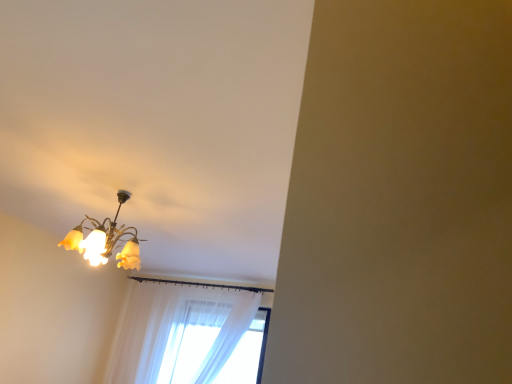
Question: Does matte glass chandelier at upper left have a lesser width compared to sheer white curtain at lower center?

Choices:
 (A) yes
 (B) no

Answer: (B)

Question: Is matte glass chandelier at upper left shorter than sheer white curtain at lower center?

Choices:
 (A) yes
 (B) no

Answer: (A)

Question: Is matte glass chandelier at upper left positioned in front of sheer white curtain at lower center?

Choices:
 (A) yes
 (B) no

Answer: (A)

Question: Can we say matte glass chandelier at upper left lies outside sheer white curtain at lower center?

Choices:
 (A) no
 (B) yes

Answer: (B)

Question: Does matte glass chandelier at upper left have a greater height compared to sheer white curtain at lower center?

Choices:
 (A) no
 (B) yes

Answer: (A)

Question: Is matte glass chandelier at upper left behind sheer white curtain at lower center?

Choices:
 (A) yes
 (B) no

Answer: (B)

Question: Does sheer white curtain at lower center contain matte glass chandelier at upper left?

Choices:
 (A) no
 (B) yes

Answer: (A)

Question: Is sheer white curtain at lower center further to camera compared to matte glass chandelier at upper left?

Choices:
 (A) no
 (B) yes

Answer: (B)

Question: Does sheer white curtain at lower center come in front of matte glass chandelier at upper left?

Choices:
 (A) no
 (B) yes

Answer: (A)

Question: From the image's perspective, would you say sheer white curtain at lower center is shown under matte glass chandelier at upper left?

Choices:
 (A) no
 (B) yes

Answer: (B)

Question: From the image's perspective, would you say sheer white curtain at lower center is positioned over matte glass chandelier at upper left?

Choices:
 (A) no
 (B) yes

Answer: (A)

Question: Considering the relative positions of sheer white curtain at lower center and matte glass chandelier at upper left in the image provided, is sheer white curtain at lower center to the right of matte glass chandelier at upper left from the viewer's perspective?

Choices:
 (A) no
 (B) yes

Answer: (B)

Question: Considering the positions of point (124, 200) and point (175, 317), is point (124, 200) closer or farther from the camera than point (175, 317)?

Choices:
 (A) farther
 (B) closer

Answer: (B)